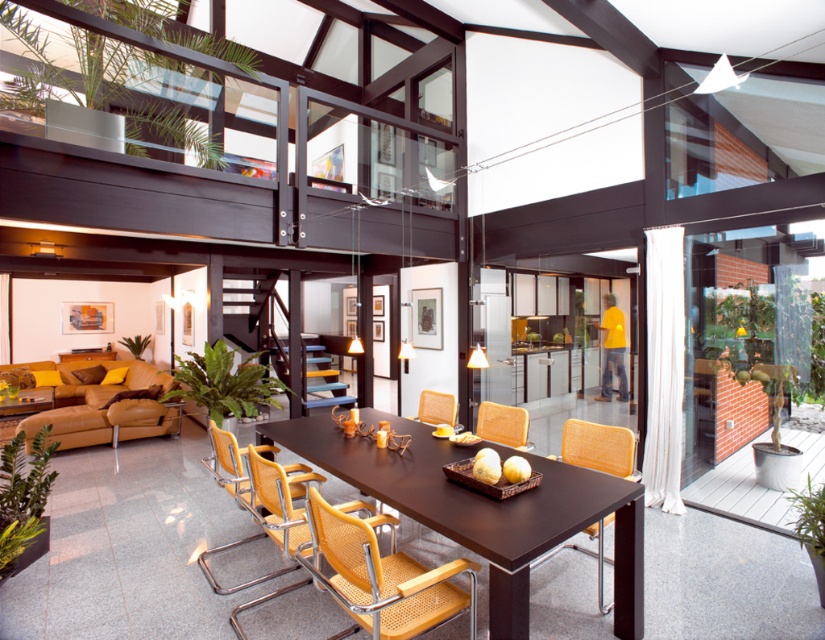
Can you confirm if matte woven armchair at center is positioned below woven wood chair at center?

Indeed, matte woven armchair at center is positioned under woven wood chair at center.

Image resolution: width=825 pixels, height=640 pixels. I want to click on matte woven armchair at center, so click(436, 408).

Can you confirm if transparent glass door at center is positioned below orange woven chair at right?

Actually, transparent glass door at center is above orange woven chair at right.

Does transparent glass door at center have a smaller size compared to orange woven chair at right?

No, transparent glass door at center is not smaller than orange woven chair at right.

Between point (517, 273) and point (588, 552), which one is positioned in front?

Point (588, 552)

Where is `transparent glass door at center`? Image resolution: width=825 pixels, height=640 pixels. transparent glass door at center is located at coordinates (554, 349).

Measure the distance from brown wood table at center to yellow fabric chair at center.

brown wood table at center is 25.96 inches away from yellow fabric chair at center.

Who is lower down, brown wood table at center or yellow fabric chair at center?

yellow fabric chair at center is below.

Is point (297, 449) in front of point (224, 545)?

Yes, point (297, 449) is closer to viewer.

Locate an element on the screen. brown wood table at center is located at coordinates (484, 509).